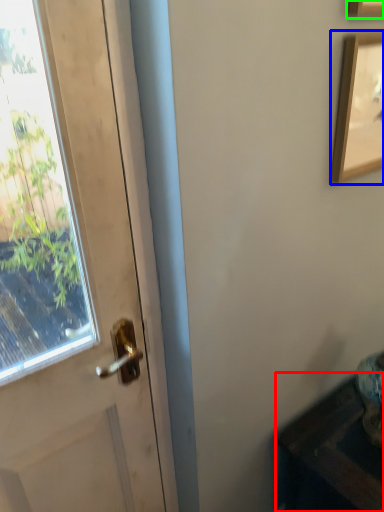
Question: Considering the real-world distances, which object is farthest from furniture (highlighted by a red box)? picture frame (highlighted by a blue box) or picture frame (highlighted by a green box)?

Choices:
 (A) picture frame
 (B) picture frame

Answer: (B)